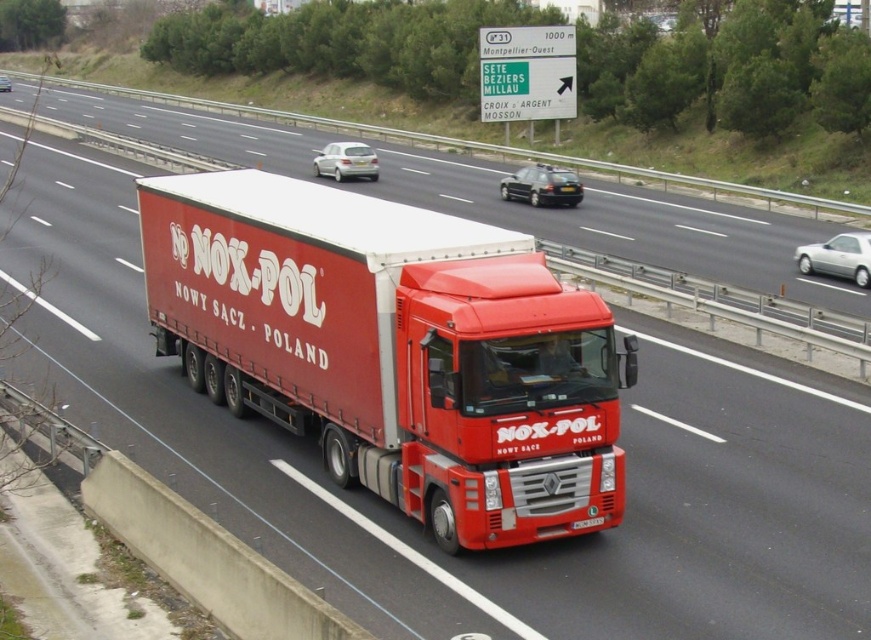
Question: Is the position of satin silver sedan at center less distant than that of black plastic license plate at center?

Choices:
 (A) yes
 (B) no

Answer: (B)

Question: Which object is the closest to the matte black car at center?

Choices:
 (A) black plastic license plate at center
 (B) silver metallic sedan at right
 (C) satin silver sedan at center
 (D) matte red truck at center

Answer: (C)

Question: Which point is closer to the camera?

Choices:
 (A) silver metallic sedan at center
 (B) matte black car at center

Answer: (B)

Question: Does matte red truck at center come behind satin silver sedan at center?

Choices:
 (A) no
 (B) yes

Answer: (A)

Question: Is matte red truck at center smaller than silver metallic sedan at center?

Choices:
 (A) no
 (B) yes

Answer: (B)

Question: Which of these objects is positioned closest to the silver metallic sedan at center?

Choices:
 (A) matte red truck at center
 (B) satin silver sedan at center
 (C) black plastic license plate at center

Answer: (B)